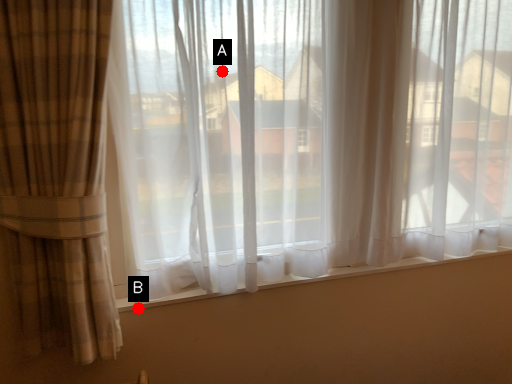
Question: Two points are circled on the image, labeled by A and B beside each circle. Which point is closer to the camera taking this photo?

Choices:
 (A) A is closer
 (B) B is closer

Answer: (A)